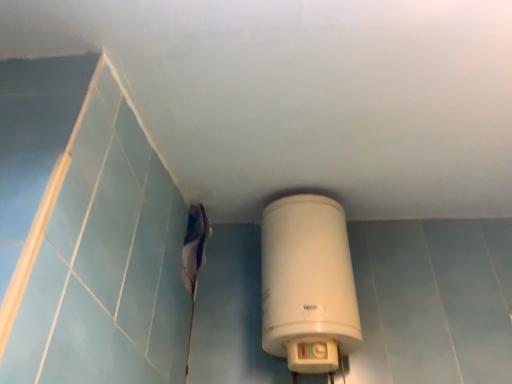
This screenshot has width=512, height=384. What do you see at coordinates (308, 284) in the screenshot?
I see `white matte tank at center` at bounding box center [308, 284].

Where is `white matte tank at center`? white matte tank at center is located at coordinates (308, 284).

Find the location of a particular element. The image size is (512, 384). white matte tank at center is located at coordinates (308, 284).